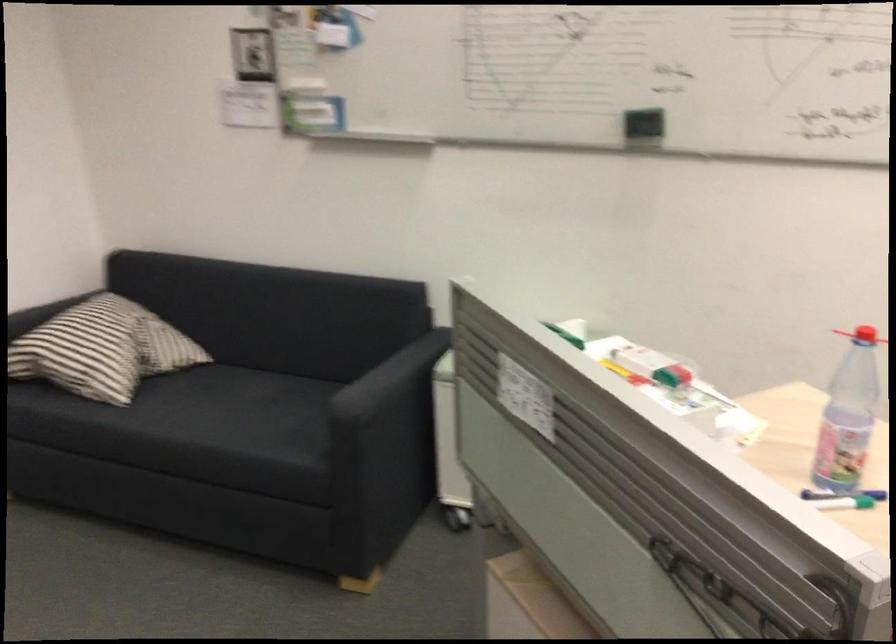
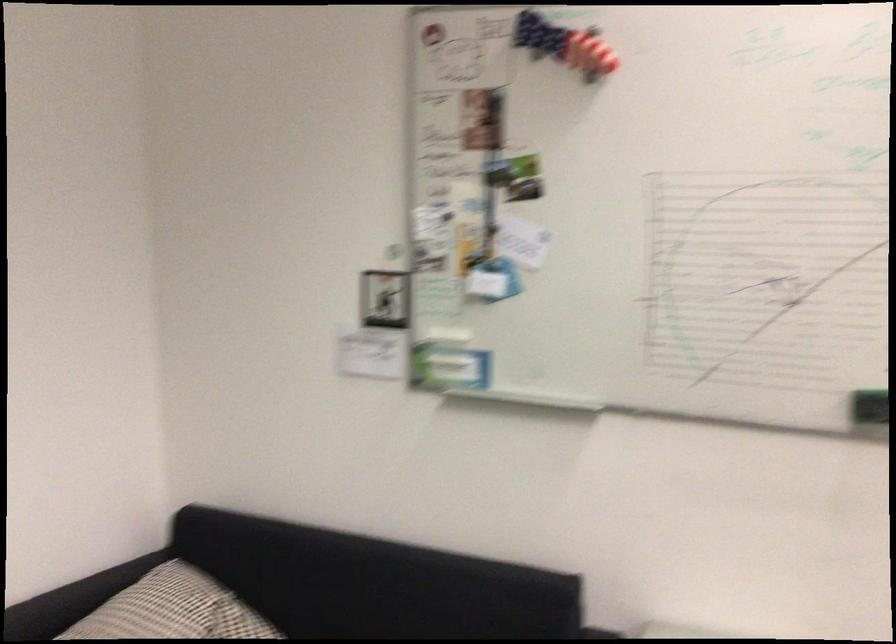
Locate, in the second image, the point that corresponds to point 122,323 in the first image.

(193, 612)